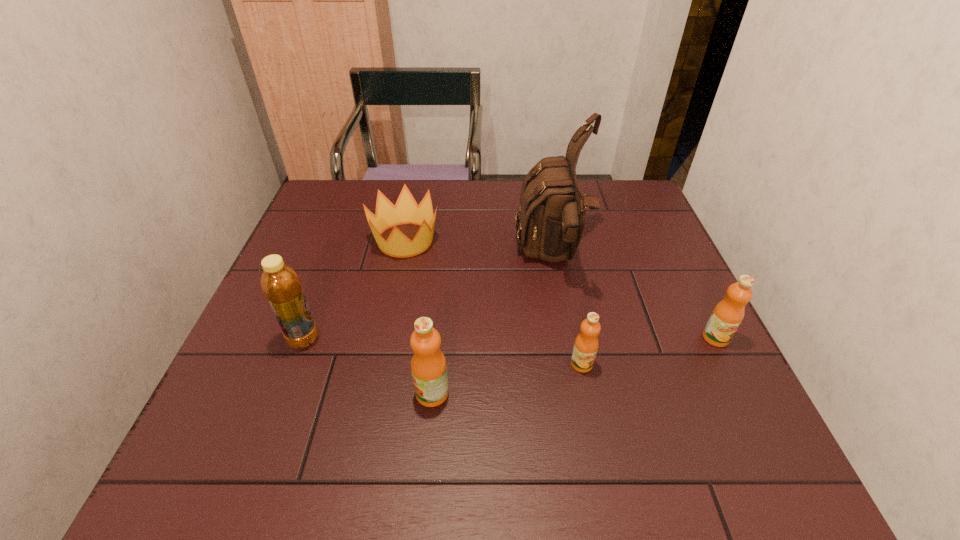
You are a GUI agent. You are given a task and a screenshot of the screen. Output one action in this format:
    pyautogui.click(x=<x>, y=<y>)
    Task: Click on the closest orange juice to the leftmost orange juice
    The width and height of the screenshot is (960, 540).
    Given the screenshot: What is the action you would take?
    pyautogui.click(x=586, y=344)

The height and width of the screenshot is (540, 960). Identify the location of orange juice that stands as the third closest to the bottle. (728, 314).

Find the location of a particular element. The image size is (960, 540). free region that satisfies the following two spatial constraints: 1. on the front label of the second tallest orange juice; 2. on the front label of the leftmost orange juice is located at coordinates (743, 393).